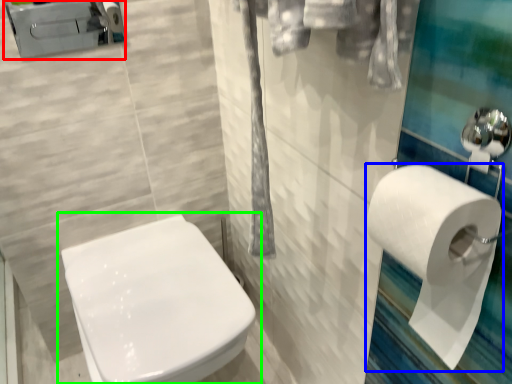
Question: Which is nearer to the porcelain (highlighted by a red box)? toilet paper (highlighted by a blue box) or toilet (highlighted by a green box).

Choices:
 (A) toilet paper
 (B) toilet

Answer: (B)